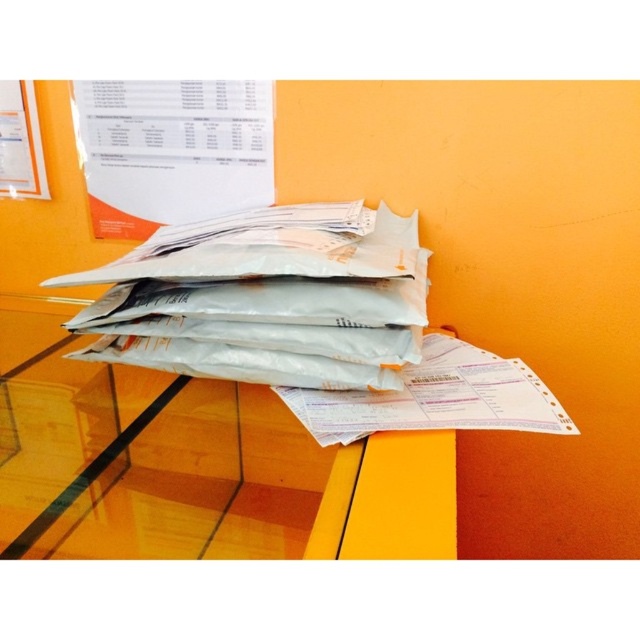
Does transparent glass table at center lie in front of white matte envelopes at center?

Yes, transparent glass table at center is closer to the viewer.

Who is more distant from viewer, [204,461] or [305,340]?

The point [305,340] is behind.

Image resolution: width=640 pixels, height=640 pixels. Identify the location of transparent glass table at center. (141, 456).

Can you confirm if transparent glass table at center is wider than white paper at center?

Yes, transparent glass table at center is wider than white paper at center.

Does transparent glass table at center have a lesser width compared to white paper at center?

In fact, transparent glass table at center might be wider than white paper at center.

Which is behind, point (88, 419) or point (564, 420)?

The point (88, 419) is behind.

Where is `transparent glass table at center`? Image resolution: width=640 pixels, height=640 pixels. transparent glass table at center is located at coordinates (141, 456).

Does point (170, 326) lie behind point (470, 413)?

Yes, it is behind point (470, 413).

Between white matte envelopes at center and white paper at center, which one appears on the left side from the viewer's perspective?

white matte envelopes at center is more to the left.

Where is `white matte envelopes at center`? white matte envelopes at center is located at coordinates (268, 300).

You are a GUI agent. You are given a task and a screenshot of the screen. Output one action in this format:
    pyautogui.click(x=<x>, y=<y>)
    Task: Click on the white matte envelopes at center
    The height and width of the screenshot is (640, 640).
    Given the screenshot: What is the action you would take?
    pyautogui.click(x=268, y=300)